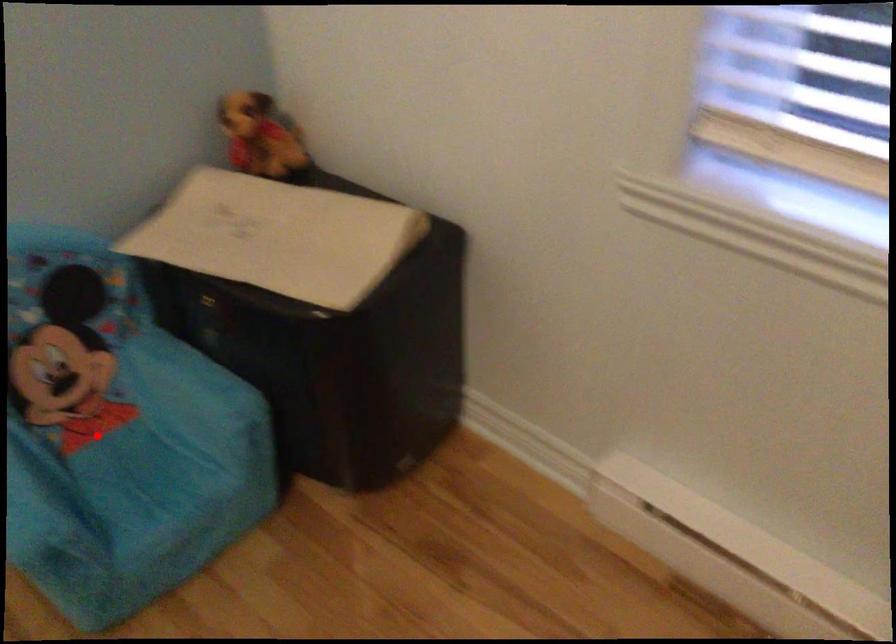
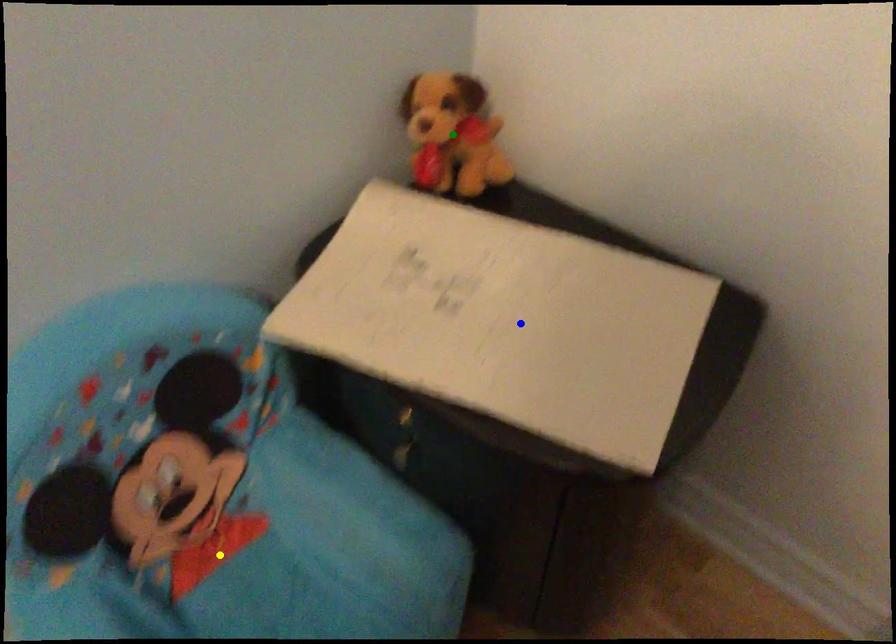
Question: I am providing you with two images of the same scene from different viewpoints. A red point is marked on the first image. You are given multiple points on the second image. Can you choose the point in image 2 that corresponds to the point in image 1?

Choices:
 (A) blue point
 (B) green point
 (C) yellow point

Answer: (C)